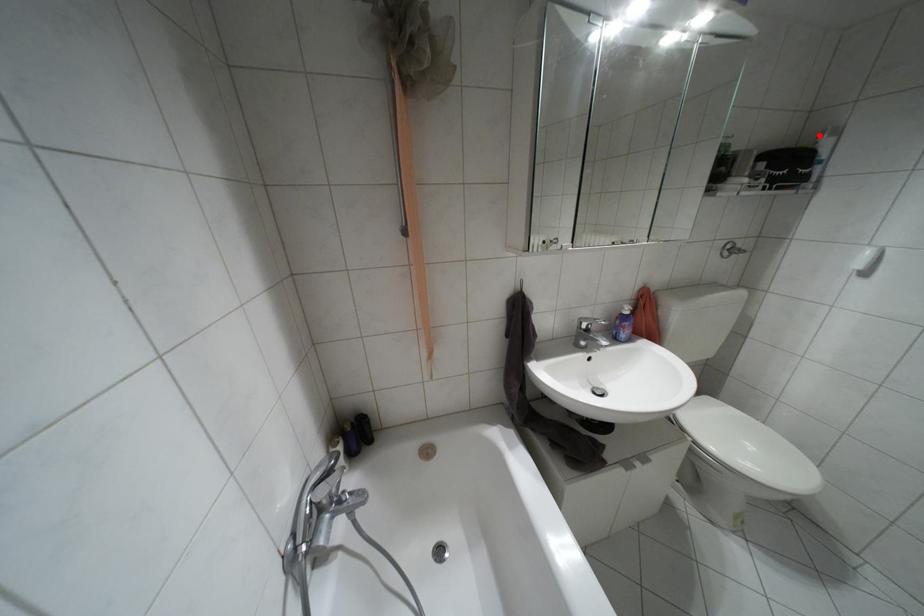
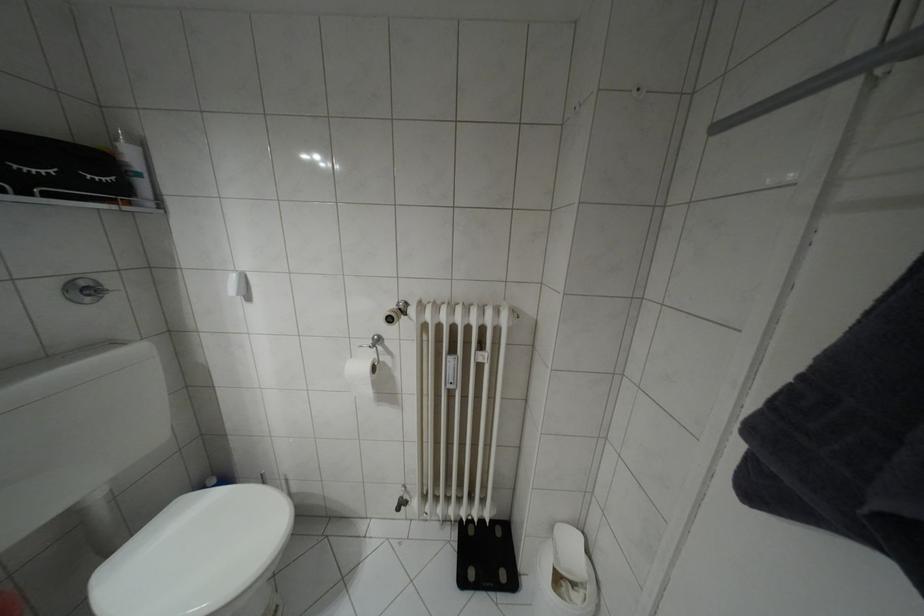
In the second image, find the point that corresponds to the highlighted location in the first image.

(116, 139)